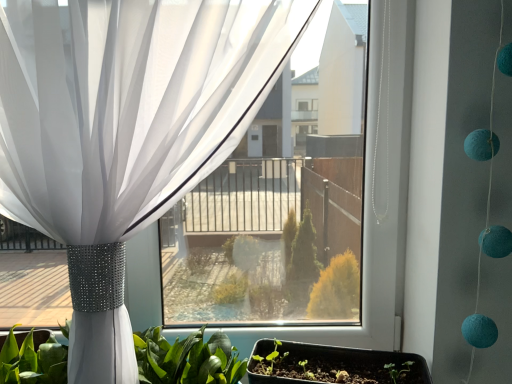
Question: Does matte black tray at lower center come in front of white sheer curtain at upper left?

Choices:
 (A) no
 (B) yes

Answer: (A)

Question: From a real-world perspective, is matte black tray at lower center below white sheer curtain at upper left?

Choices:
 (A) yes
 (B) no

Answer: (A)

Question: Is matte black tray at lower center further to camera compared to white sheer curtain at upper left?

Choices:
 (A) no
 (B) yes

Answer: (B)

Question: Is matte black tray at lower center positioned with its back to white sheer curtain at upper left?

Choices:
 (A) yes
 (B) no

Answer: (B)

Question: Is matte black tray at lower center placed right next to white sheer curtain at upper left?

Choices:
 (A) no
 (B) yes

Answer: (A)

Question: Does matte black tray at lower center have a greater height compared to white sheer curtain at upper left?

Choices:
 (A) no
 (B) yes

Answer: (A)

Question: Is green leafy plant at lower center positioned behind white sheer curtain at upper left?

Choices:
 (A) yes
 (B) no

Answer: (A)

Question: Considering the relative sizes of green leafy plant at lower center and white sheer curtain at upper left in the image provided, is green leafy plant at lower center shorter than white sheer curtain at upper left?

Choices:
 (A) no
 (B) yes

Answer: (B)

Question: From a real-world perspective, is green leafy plant at lower center over white sheer curtain at upper left?

Choices:
 (A) yes
 (B) no

Answer: (B)

Question: Does green leafy plant at lower center turn towards white sheer curtain at upper left?

Choices:
 (A) no
 (B) yes

Answer: (B)

Question: Is white sheer curtain at upper left surrounded by green leafy plant at lower center?

Choices:
 (A) yes
 (B) no

Answer: (B)

Question: Does green leafy plant at lower center have a smaller size compared to white sheer curtain at upper left?

Choices:
 (A) yes
 (B) no

Answer: (A)

Question: Is green leafy plant at lower center shorter than matte black tray at lower center?

Choices:
 (A) yes
 (B) no

Answer: (B)